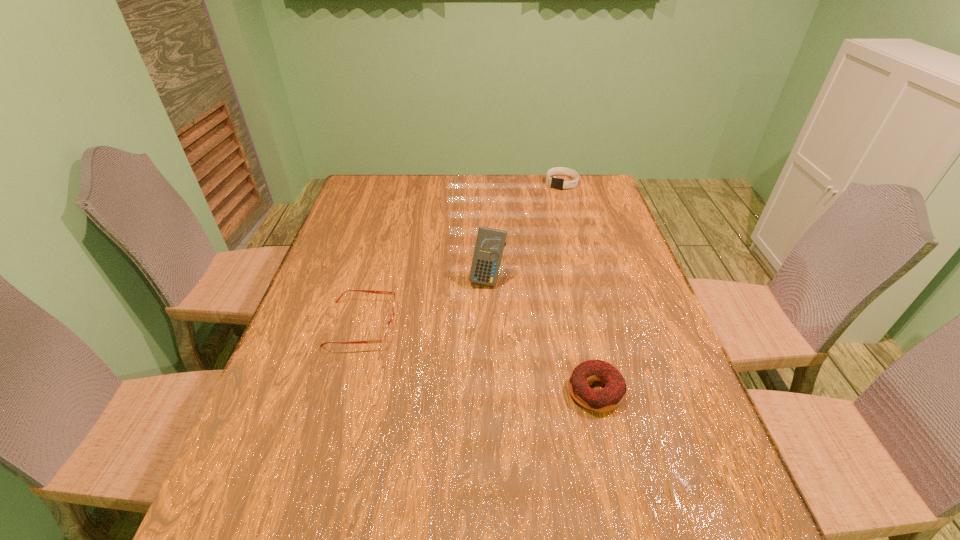
You are a GUI agent. You are given a task and a screenshot of the screen. Output one action in this format:
    pyautogui.click(x=<x>, y=<y>)
    Task: Click on the free space located on the front-facing side of the tallest object
    
    Given the screenshot: What is the action you would take?
    pyautogui.click(x=457, y=405)

Locate an element on the screen. The image size is (960, 540). vacant region located on the outer surface of the farthest object is located at coordinates (521, 235).

Where is `free region located on the outer surface of the farthest object`? The width and height of the screenshot is (960, 540). free region located on the outer surface of the farthest object is located at coordinates (542, 208).

Identify the location of free location located on the outer surface of the farthest object. The width and height of the screenshot is (960, 540). (519, 239).

What are the coordinates of `object positioned at the far edge` in the screenshot? It's located at (557, 183).

Where is `object situated at the left edge`? Image resolution: width=960 pixels, height=540 pixels. object situated at the left edge is located at coordinates (388, 331).

This screenshot has height=540, width=960. Find the location of `doughnut situated at the right edge`. doughnut situated at the right edge is located at coordinates (608, 398).

Locate an element on the screen. wristband that is at the right edge is located at coordinates (557, 183).

At what (x,y) coordinates should I click in order to perform the action: click on object located at the far right corner. Please return your answer as a coordinate pair (x, y). Looking at the image, I should click on [x=557, y=183].

In the image, there is a desktop. Identify the location of vacant space at the far edge. The width and height of the screenshot is (960, 540). (421, 185).